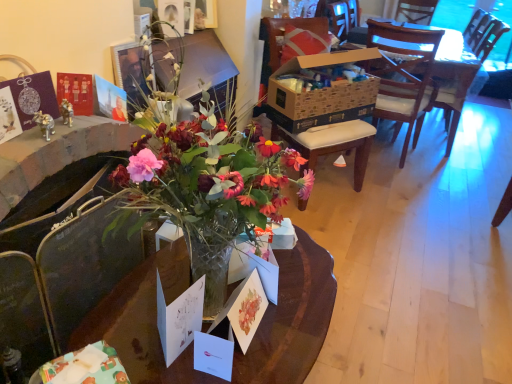
The height and width of the screenshot is (384, 512). I want to click on free space in front of matte paper postcard at center, the third postcard when ordered from left to right, so click(x=250, y=362).